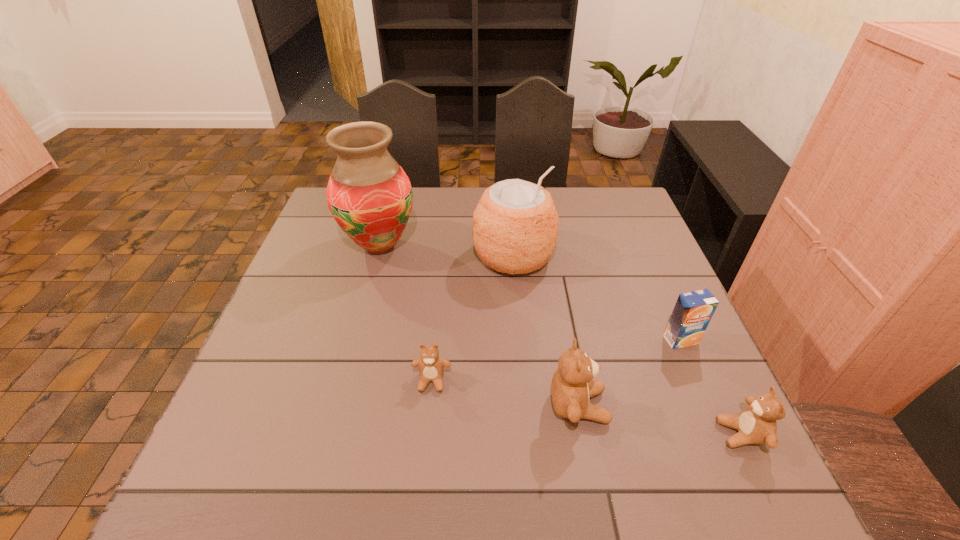
Where is `orange_juice located in the right edge section of the desktop`? This screenshot has width=960, height=540. orange_juice located in the right edge section of the desktop is located at coordinates (693, 310).

In order to click on object that is at the far left corner in this screenshot , I will do `click(369, 195)`.

Where is `object located in the near right corner section of the desktop`? The height and width of the screenshot is (540, 960). object located in the near right corner section of the desktop is located at coordinates (756, 424).

In order to click on blank space at the far edge of the desktop in this screenshot , I will do `click(564, 222)`.

The height and width of the screenshot is (540, 960). Find the location of `free space at the near edge of the desktop`. free space at the near edge of the desktop is located at coordinates 507,419.

Where is `vacant space at the left edge of the desktop`? The width and height of the screenshot is (960, 540). vacant space at the left edge of the desktop is located at coordinates (304, 261).

Image resolution: width=960 pixels, height=540 pixels. In order to click on vacant space at the right edge of the desktop in this screenshot , I will do `click(696, 352)`.

In the image, there is a desktop. What are the coordinates of `vacant space at the near right corner` in the screenshot? It's located at (709, 432).

Identify the location of free space that is in between the second tallest teddy bear and the leftmost object. The width and height of the screenshot is (960, 540). (561, 340).

Identify the location of vacant area that lies between the fifth shortest object and the fourth shortest object. The image size is (960, 540). click(546, 331).